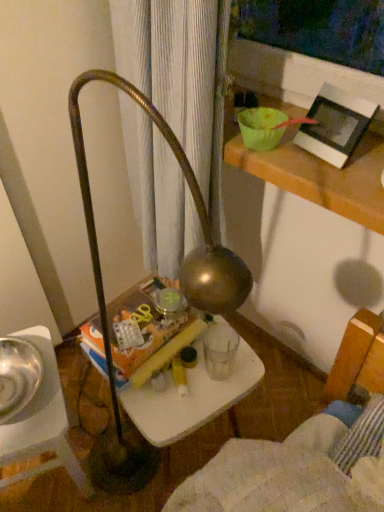
Question: Is white plastic table at center oriented towards shiny metallic bowl at left?

Choices:
 (A) yes
 (B) no

Answer: (B)

Question: Is white plastic table at center in front of shiny metallic bowl at left?

Choices:
 (A) yes
 (B) no

Answer: (B)

Question: From the image's perspective, is white plastic table at center located beneath shiny metallic bowl at left?

Choices:
 (A) no
 (B) yes

Answer: (B)

Question: Is white plastic table at center further to the viewer compared to shiny metallic bowl at left?

Choices:
 (A) yes
 (B) no

Answer: (A)

Question: Is white plastic table at center completely or partially outside of shiny metallic bowl at left?

Choices:
 (A) yes
 (B) no

Answer: (A)

Question: Can you see white plastic table at center touching shiny metallic bowl at left?

Choices:
 (A) no
 (B) yes

Answer: (A)

Question: Does shiny metallic bowl at left come in front of white plastic table at center?

Choices:
 (A) no
 (B) yes

Answer: (B)

Question: Does shiny metallic bowl at left have a greater width compared to white plastic table at center?

Choices:
 (A) no
 (B) yes

Answer: (A)

Question: Is shiny metallic bowl at left looking in the opposite direction of white plastic table at center?

Choices:
 (A) yes
 (B) no

Answer: (B)

Question: Is shiny metallic bowl at left at the right side of white plastic table at center?

Choices:
 (A) yes
 (B) no

Answer: (B)

Question: Does shiny metallic bowl at left have a greater height compared to white plastic table at center?

Choices:
 (A) yes
 (B) no

Answer: (B)

Question: Is shiny metallic bowl at left at the left side of white plastic table at center?

Choices:
 (A) no
 (B) yes

Answer: (B)

Question: From a real-world perspective, is metallic silver bowl at lower left below white matte picture frame at upper right?

Choices:
 (A) no
 (B) yes

Answer: (B)